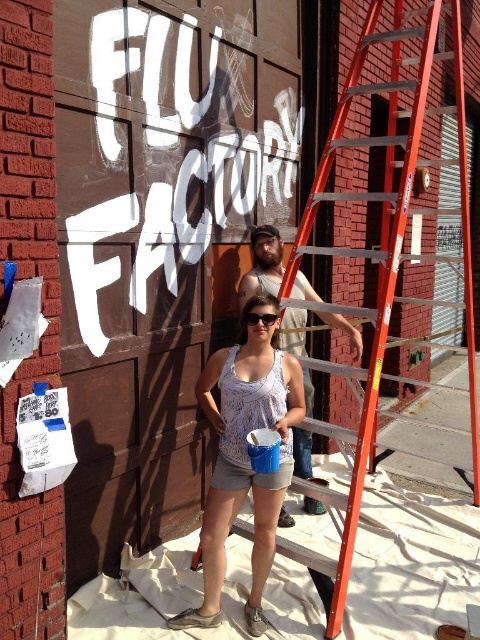
Question: Which of the following is the closest to the observer?

Choices:
 (A) orange metallic ladder at center
 (B) white printed tank top at center

Answer: (B)

Question: Which point is farther to the camera?

Choices:
 (A) (469, 230)
 (B) (254, 312)
 (C) (311, 444)

Answer: (A)

Question: Is white printed tank top at center to the right of tank top at center from the viewer's perspective?

Choices:
 (A) yes
 (B) no

Answer: (B)

Question: Is tank top at center to the right of black plastic goggles at center from the viewer's perspective?

Choices:
 (A) yes
 (B) no

Answer: (A)

Question: Which of the following is the farthest from the observer?

Choices:
 (A) tank top at center
 (B) black plastic goggles at center
 (C) orange metallic ladder at center

Answer: (A)

Question: Can you confirm if white printed tank top at center is positioned below tank top at center?

Choices:
 (A) yes
 (B) no

Answer: (A)